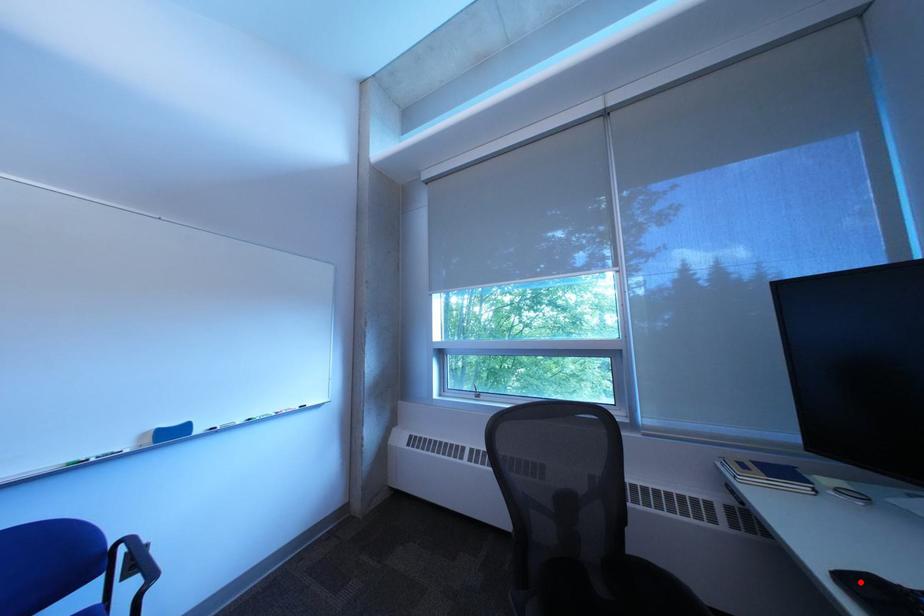
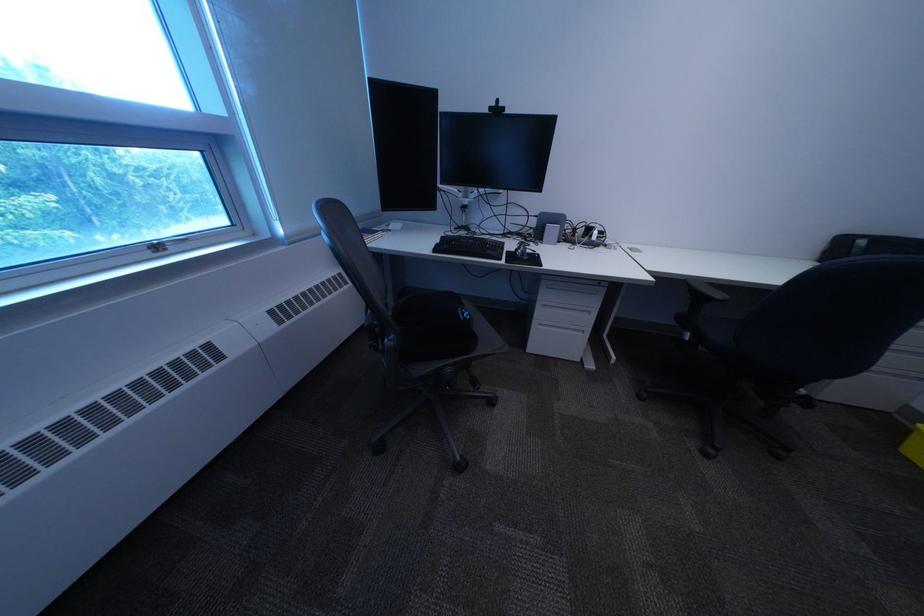
The point at the highlighted location is marked in the first image. Where is the corresponding point in the second image?

(451, 252)